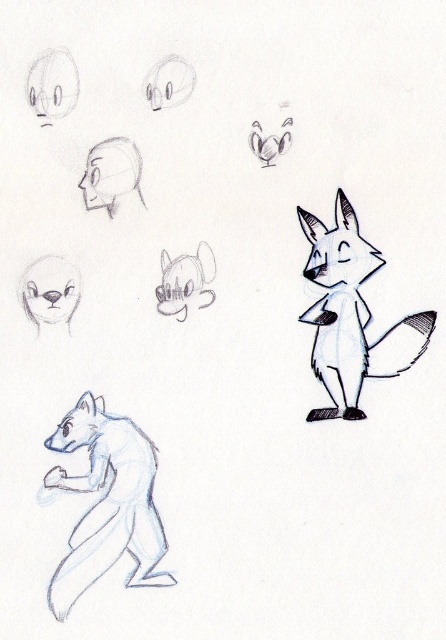
Question: Can you confirm if smooth gray fox at center is positioned below smooth gray fox at upper center?

Choices:
 (A) no
 (B) yes

Answer: (B)

Question: Which is nearer to the smooth gray fox at upper center?

Choices:
 (A) smooth gray fox at center
 (B) white fur fox at lower left
 (C) smooth gray fox at upper left
 (D) smooth gray fox head at upper left

Answer: (A)

Question: Which object is farther from the camera taking this photo?

Choices:
 (A) smooth gray fox head at upper left
 (B) white fur fox at lower left
 (C) white paper fox at center right

Answer: (A)

Question: Is the position of white fur fox at lower left more distant than that of white paper fox at center right?

Choices:
 (A) no
 (B) yes

Answer: (A)

Question: Can you confirm if white fur fox at lower left is positioned to the right of smooth gray fox head at upper left?

Choices:
 (A) yes
 (B) no

Answer: (A)

Question: Which object appears farthest from the camera in this image?

Choices:
 (A) white paper fox at center right
 (B) smooth gray fox head at upper left
 (C) smooth gray fox at center
 (D) smooth gray fox at upper left

Answer: (C)